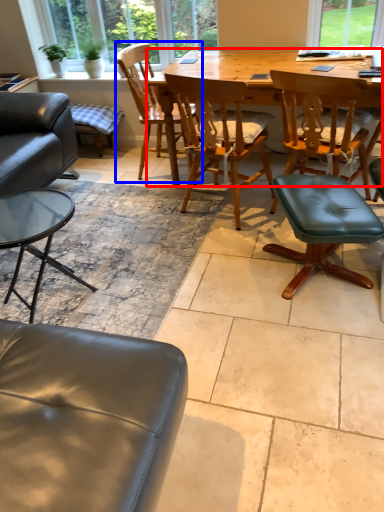
Question: Among these objects, which one is farthest to the camera, kitchen & dining room table (highlighted by a red box) or chair (highlighted by a blue box)?

Choices:
 (A) kitchen & dining room table
 (B) chair

Answer: (B)